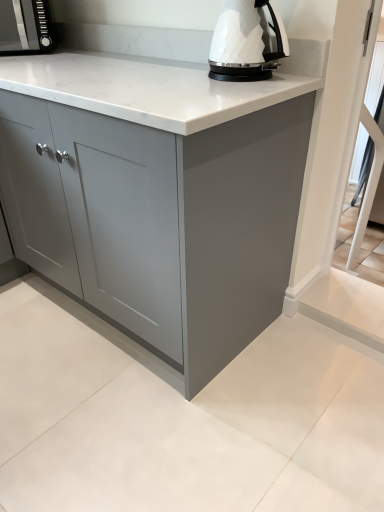
Question: Relative to white glossy electric kettle at upper center, is matte black microwave at upper left in front or behind?

Choices:
 (A) behind
 (B) front

Answer: (A)

Question: Based on their positions, is matte black microwave at upper left located to the left or right of white glossy electric kettle at upper center?

Choices:
 (A) left
 (B) right

Answer: (A)

Question: Which object is the farthest from the matte black microwave at upper left?

Choices:
 (A) white glossy electric kettle at upper center
 (B) matte gray cabinet at center

Answer: (B)

Question: Which of these objects is positioned closest to the matte black microwave at upper left?

Choices:
 (A) white glossy electric kettle at upper center
 (B) matte gray cabinet at center

Answer: (A)